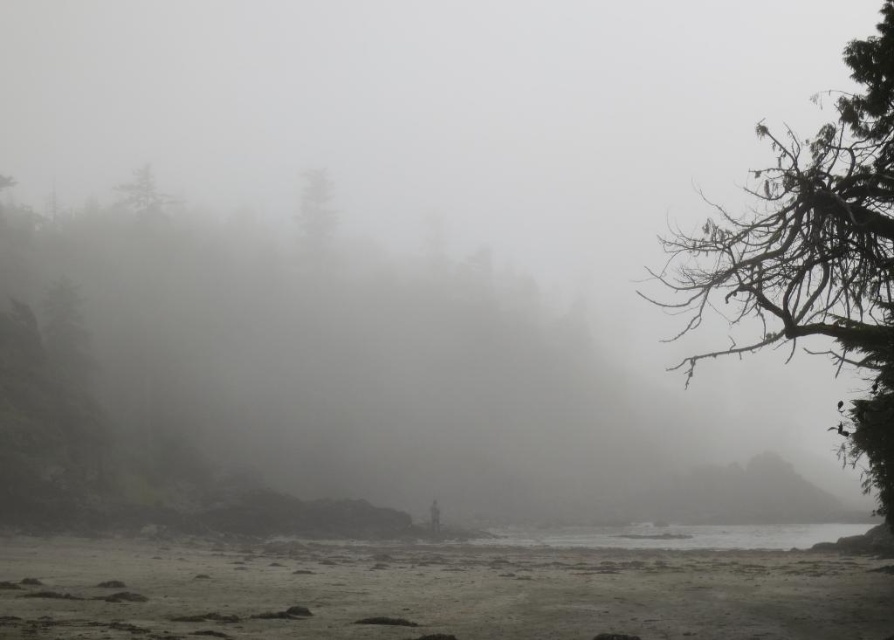
Is point (697, 579) farther from viewer compared to point (298, 202)?

No, (697, 579) is in front of (298, 202).

Can you confirm if gray sand shoreline at lower center is bigger than green matte tree at center?

Yes.

Does point (440, 545) come behind point (309, 179)?

No, it is not.

The height and width of the screenshot is (640, 894). Identify the location of gray sand shoreline at lower center. (450, 586).

Can you confirm if clear water at lower center is wider than green matte tree at center?

Yes.

Is clear water at lower center to the right of green matte tree at center from the viewer's perspective?

Indeed, clear water at lower center is positioned on the right side of green matte tree at center.

Who is more forward, (669, 525) or (334, 228)?

Point (669, 525) is more forward.

Where is `clear water at lower center`? clear water at lower center is located at coordinates (681, 536).

Is point (721, 564) positioned behind point (689, 374)?

Yes, point (721, 564) is farther from viewer.

Between point (275, 627) and point (890, 340), which one is positioned in front?

Positioned in front is point (890, 340).

In order to click on gray sand shoreline at lower center in this screenshot , I will do `click(450, 586)`.